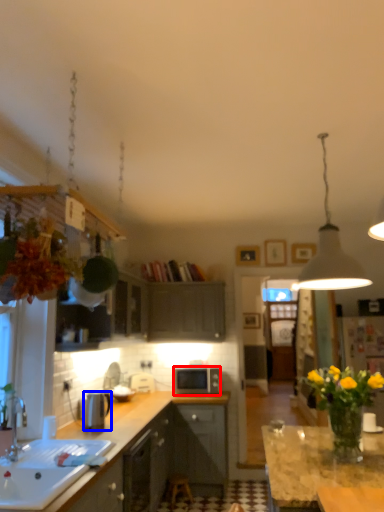
Question: Which object appears farthest to the camera in this image, microwave oven (highlighted by a red box) or kitchen appliance (highlighted by a blue box)?

Choices:
 (A) microwave oven
 (B) kitchen appliance

Answer: (A)